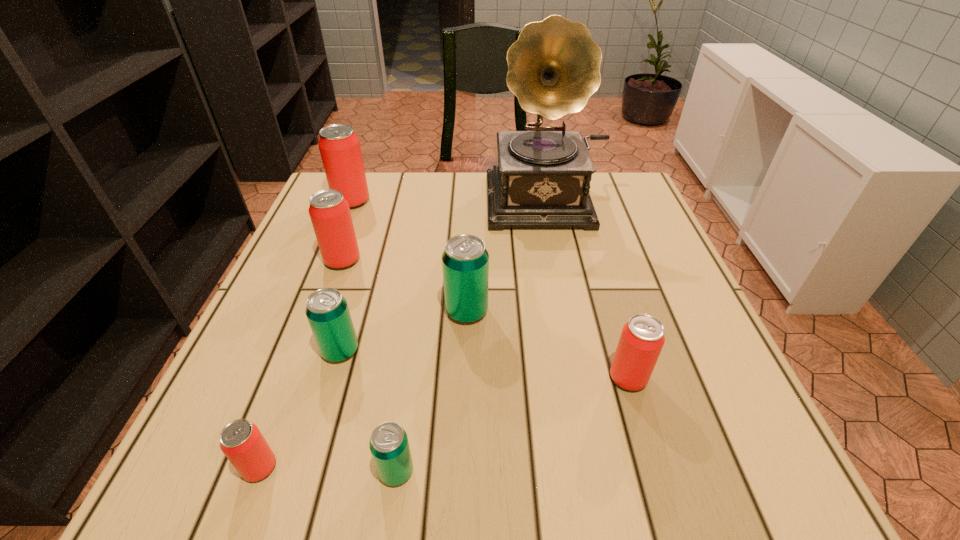
Where is `free space at the far edge of the desktop`? free space at the far edge of the desktop is located at coordinates (442, 208).

In the image, there is a desktop. What are the coordinates of `vacant space at the near edge` in the screenshot? It's located at (635, 474).

Locate an element on the screen. vacant space at the left edge is located at coordinates (272, 423).

At what (x,y) coordinates should I click in order to perform the action: click on blank space at the right edge of the desktop. Please return your answer as a coordinate pair (x, y). The image size is (960, 540). Looking at the image, I should click on (692, 361).

Locate an element on the screen. Image resolution: width=960 pixels, height=540 pixels. vacant space at the far right corner of the desktop is located at coordinates (614, 205).

The height and width of the screenshot is (540, 960). In order to click on vacant space that's between the biggest teal beer can and the second smallest teal beer can in this screenshot , I will do `click(403, 331)`.

Find the location of `free space between the biggest red beer can and the rightmost beer can`. free space between the biggest red beer can and the rightmost beer can is located at coordinates (490, 289).

Find the location of a particular element. vacant space in between the tallest object and the smallest red beer can is located at coordinates [405, 333].

The height and width of the screenshot is (540, 960). Find the location of `empty space that is in between the smallest teal beer can and the biggest teal beer can`. empty space that is in between the smallest teal beer can and the biggest teal beer can is located at coordinates 432,391.

Image resolution: width=960 pixels, height=540 pixels. Identify the location of free spot between the fifth beer can from left to right and the rightmost beer can. (513, 424).